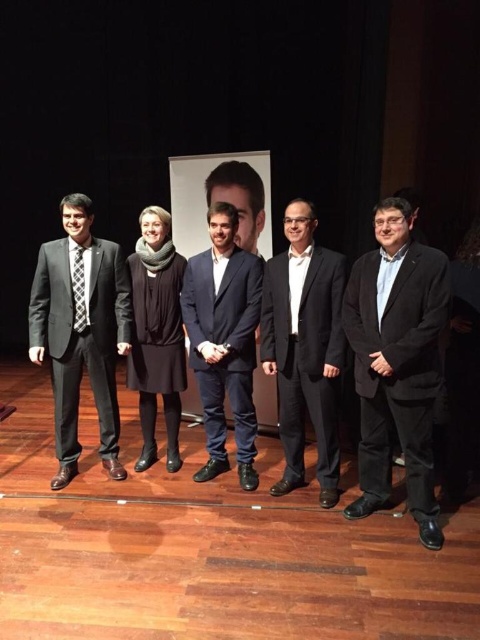
Question: Is black matte suit at right further to camera compared to matte black suit at left?

Choices:
 (A) no
 (B) yes

Answer: (A)

Question: Based on their relative distances, which object is nearer to the wooden floor at lower center?

Choices:
 (A) checkered fabric tie at left
 (B) black matte suit at right
 (C) matte black suit at left
 (D) black matte suit at center

Answer: (D)

Question: Can you confirm if black matte suit at center is positioned above dark blue suit at center?

Choices:
 (A) no
 (B) yes

Answer: (A)

Question: Can you confirm if black matte suit at right is smaller than checkered fabric tie at left?

Choices:
 (A) no
 (B) yes

Answer: (A)

Question: Which point is closer to the camera?

Choices:
 (A) black matte suit at center
 (B) wooden floor at lower center

Answer: (B)

Question: Which of the following is the farthest from the observer?

Choices:
 (A) (73, 209)
 (B) (79, 257)
 (C) (26, 424)
 (D) (339, 324)

Answer: (C)